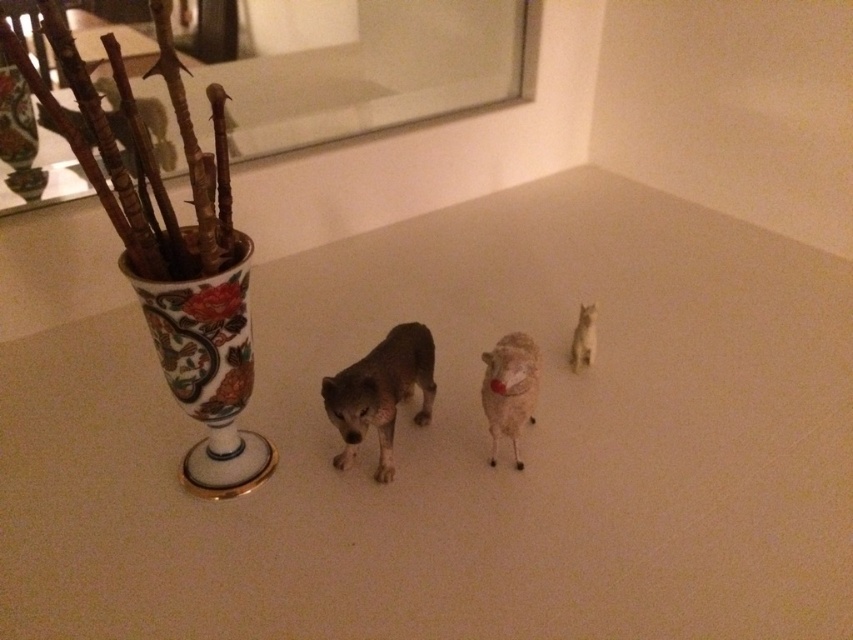
Which is in front, point (190, 397) or point (583, 321)?

Point (190, 397) is in front.

Which is in front, point (180, 232) or point (582, 314)?

Point (180, 232)

I want to click on porcelain vase at left, so click(x=209, y=368).

Which of these two, porcelain vase at left or shiny brown dog at center, stands taller?

porcelain vase at left

Which is behind, point (183, 314) or point (426, 346)?

The point (426, 346) is behind.

Does point (233, 337) come in front of point (334, 456)?

Yes.

Locate an element on the screen. Image resolution: width=853 pixels, height=640 pixels. porcelain vase at left is located at coordinates (209, 368).

Who is lower down, shiny brown dog at center or white matte sheep at center?

Positioned lower is white matte sheep at center.

The image size is (853, 640). I want to click on shiny brown dog at center, so click(380, 392).